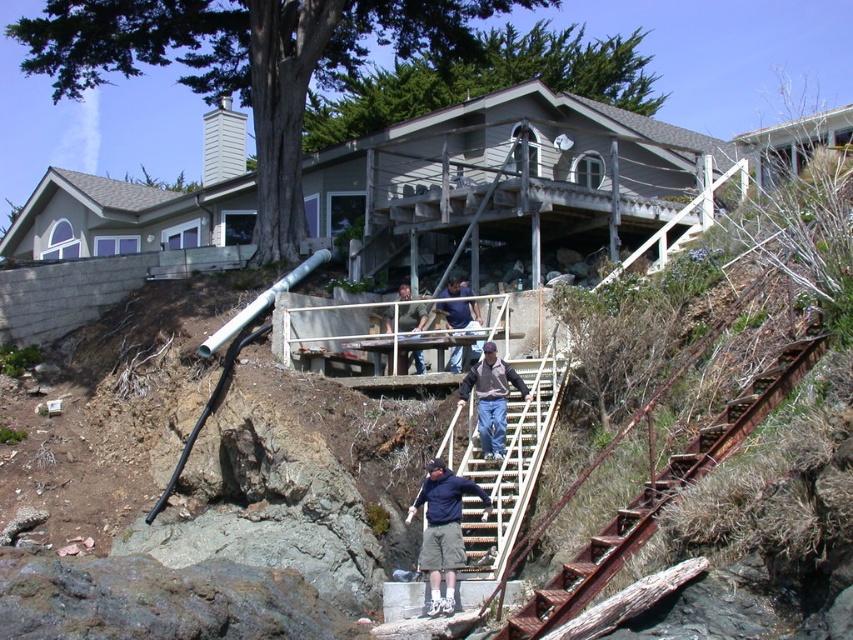
You are standing at the base of the house and want to reach the porch. The rusty metal stairs at lower right are the only path available. Are they located to your left or right side?

The rusty metal stairs at lower right are located to your right side as you face the house.

You are a delivery person trying to reach the front door of the house. You see the rusty metal stairs at lower right and the dark blue shirt at center. Which object is larger in size?

The rusty metal stairs at lower right is bigger than dark blue shirt at center, so the rusty metal stairs at lower right is the larger object.